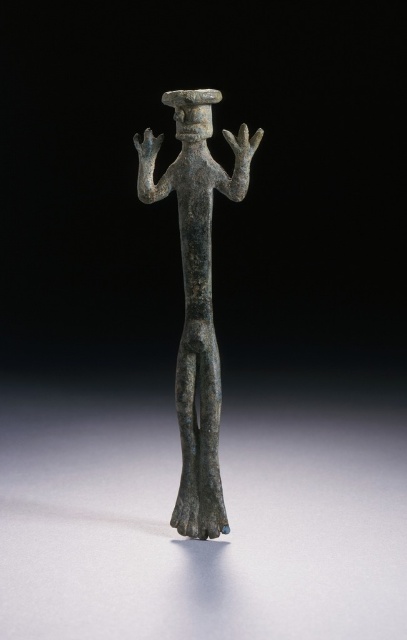
You are an archaeologist examining the ancient figurine. You notice two points on its surface labeled as point 1 at coordinates point (234,138) and point 2 at coordinates point (153,160). Which point is closer to your viewpoint?

Point (234,138) is closer to the viewer than point (153,160).

You are an archaeologist examining the bronze statue at center and the bronze textured hand at center in the image. Which object has a greater width according to the description?

The bronze statue at center has a greater width than the bronze textured hand at center.